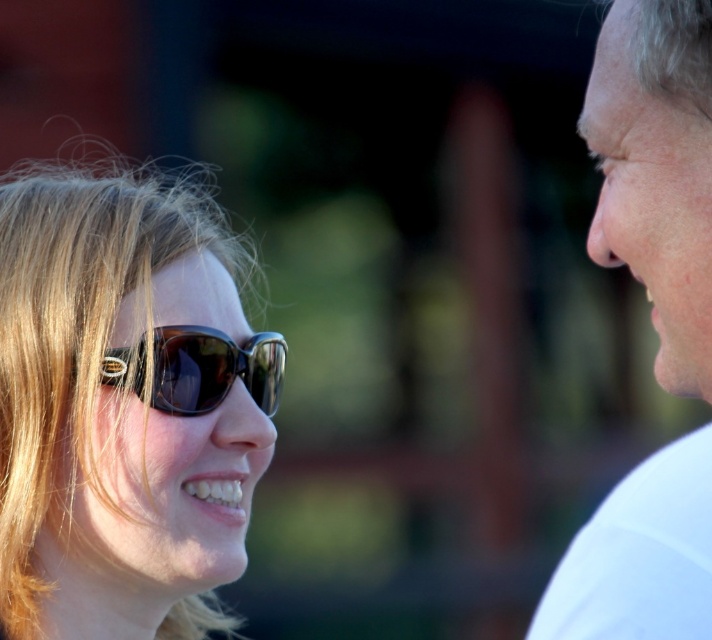
Does white matte face at right lie in front of matte black sunglasses at center?

Yes, white matte face at right is closer to the viewer.

Who is more distant from viewer, (602, 32) or (184, 381)?

The point (184, 381) is more distant.

Find the location of a particular element. white matte face at right is located at coordinates (656, 172).

Does matte brown sunglasses at left appear on the left side of matte black sunglasses at center?

Yes, matte brown sunglasses at left is to the left of matte black sunglasses at center.

Can you confirm if matte brown sunglasses at left is positioned above matte black sunglasses at center?

No, matte brown sunglasses at left is not above matte black sunglasses at center.

Where is `matte brown sunglasses at left`? This screenshot has width=712, height=640. matte brown sunglasses at left is located at coordinates (125, 406).

I want to click on matte brown sunglasses at left, so click(125, 406).

Is matte brown sunglasses at left wider than white matte face at right?

Yes.

Does point (110, 568) lie in front of point (638, 508)?

That is False.

Image resolution: width=712 pixels, height=640 pixels. I want to click on matte brown sunglasses at left, so click(x=125, y=406).